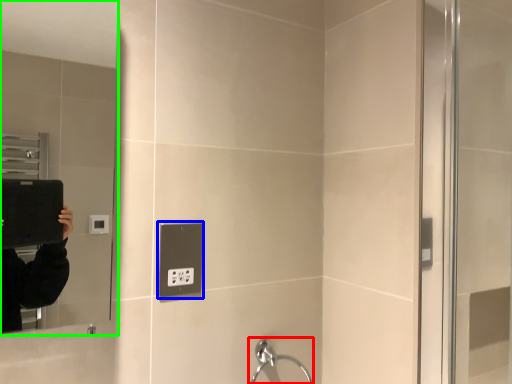
Question: Which is nearer to the faucet (highlighted by a red box)? electric outlet (highlighted by a blue box) or mirror (highlighted by a green box).

Choices:
 (A) electric outlet
 (B) mirror

Answer: (A)